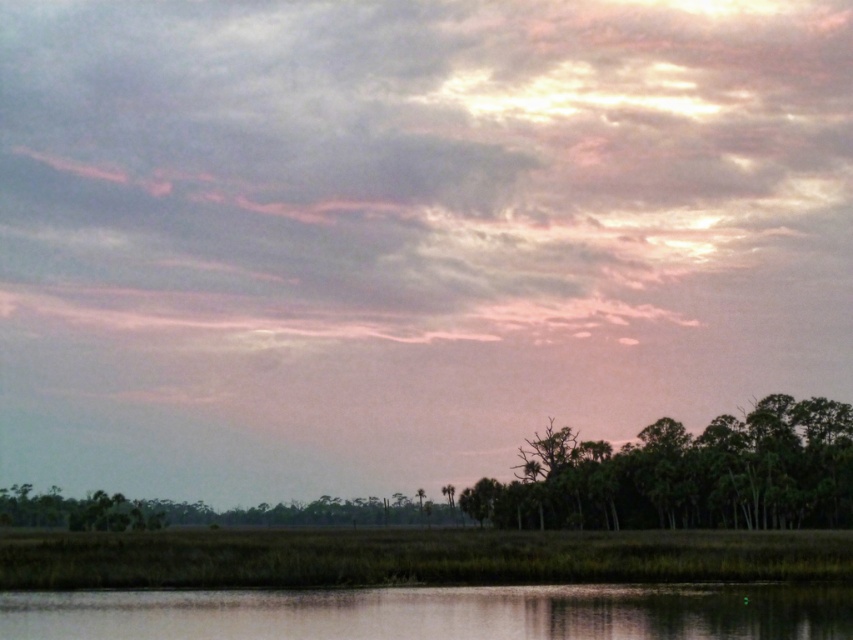
Question: Which of the following is the closest to the observer?

Choices:
 (A) smooth water at bottom
 (B) green leafy trees at lower right

Answer: (A)

Question: Is the position of smooth water at bottom less distant than that of green leafy trees at lower right?

Choices:
 (A) no
 (B) yes

Answer: (B)

Question: In this image, where is smooth water at bottom located relative to green leafy trees at lower right?

Choices:
 (A) left
 (B) right

Answer: (A)

Question: Is smooth water at bottom above green leafy trees at lower right?

Choices:
 (A) no
 (B) yes

Answer: (B)